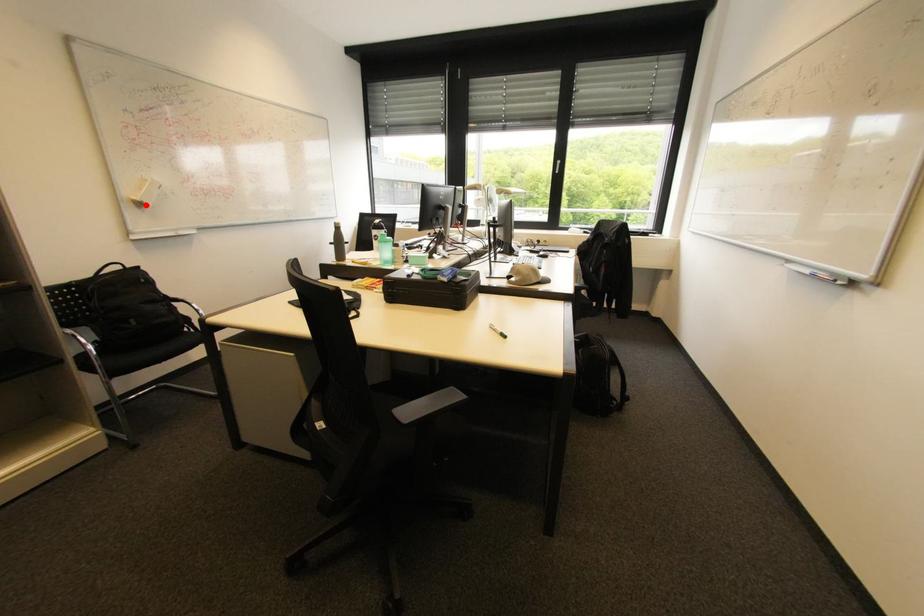
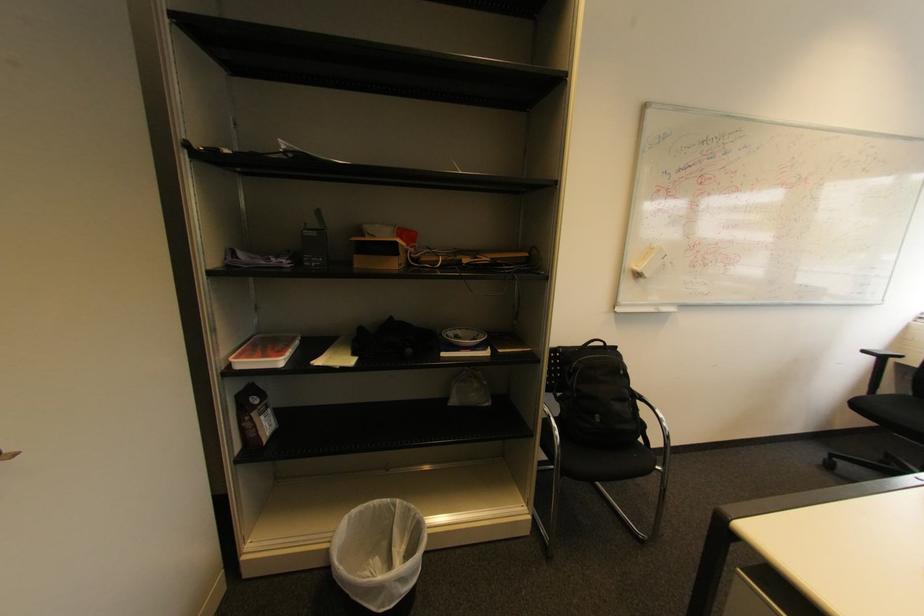
The point at the highlighted location is marked in the first image. Where is the corresponding point in the second image?

(643, 276)